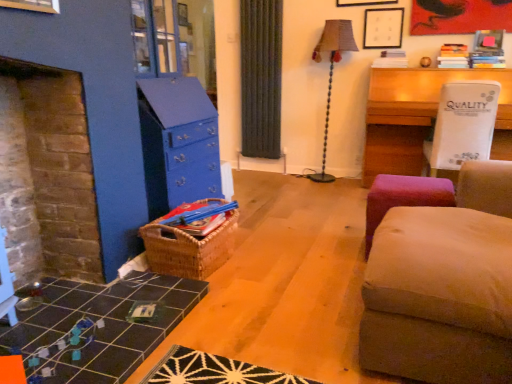
Locate an element on the screen. The height and width of the screenshot is (384, 512). free point to the right of black tile table at lower left, the second table viewed from the back is located at coordinates (249, 324).